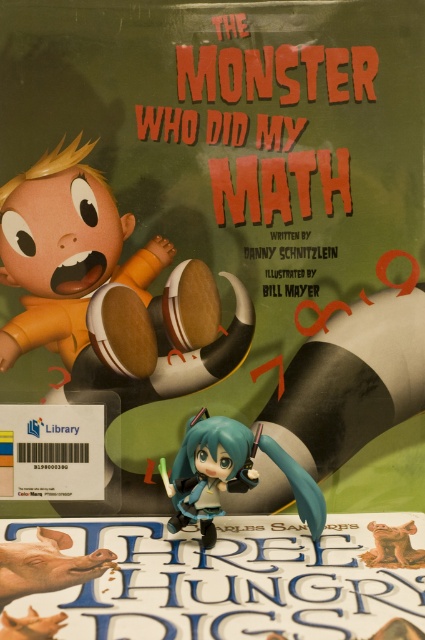
Measure the distance from matte orange plush toy at upper left to semi-glossy black figurine at center.

The distance of matte orange plush toy at upper left from semi-glossy black figurine at center is 24.74 centimeters.

Is matte orange plush toy at upper left closer to the viewer compared to semi-glossy black figurine at center?

No.

Locate an element on the screen. matte orange plush toy at upper left is located at coordinates (107, 291).